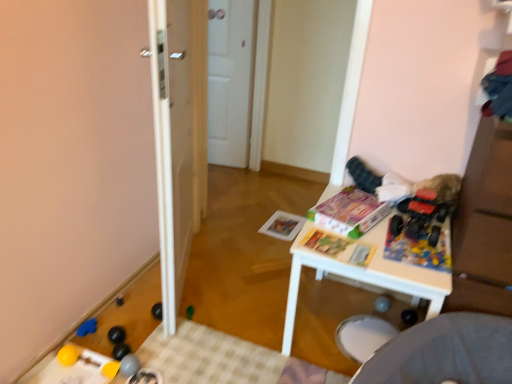
You are a GUI agent. You are given a task and a screenshot of the screen. Output one action in this format:
    pyautogui.click(x=<x>, y=<y>)
    Task: Click on the vacant space that is to the left of rubber yellow ball at lower left, placed as the 3th toy when sorted from left to right
    The image size is (512, 384).
    Given the screenshot: What is the action you would take?
    [62, 355]